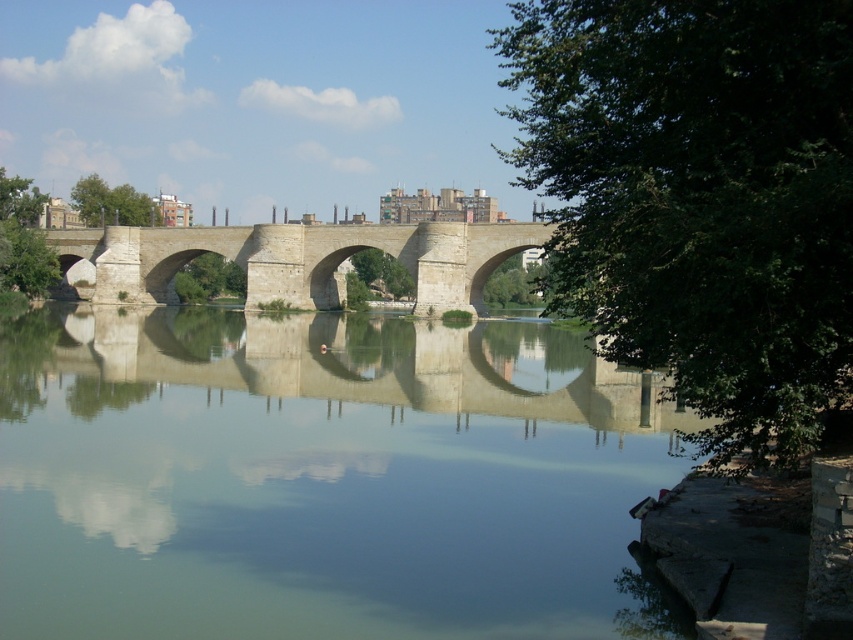
Question: Can you confirm if greenish water at center is positioned above stone bridge at center?

Choices:
 (A) yes
 (B) no

Answer: (B)

Question: Which point is closer to the camera?

Choices:
 (A) (228, 444)
 (B) (161, 266)

Answer: (A)

Question: Considering the relative positions of greenish water at center and stone bridge at center in the image provided, where is greenish water at center located with respect to stone bridge at center?

Choices:
 (A) above
 (B) below

Answer: (B)

Question: Which object appears farthest from the camera in this image?

Choices:
 (A) stone bridge at center
 (B) greenish water at center

Answer: (A)

Question: Does greenish water at center appear on the left side of stone bridge at center?

Choices:
 (A) yes
 (B) no

Answer: (B)